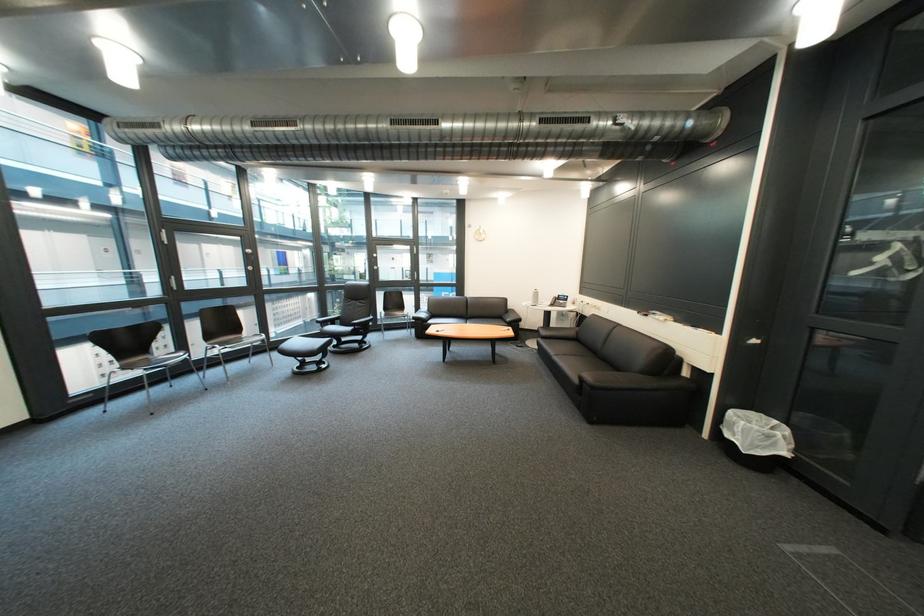
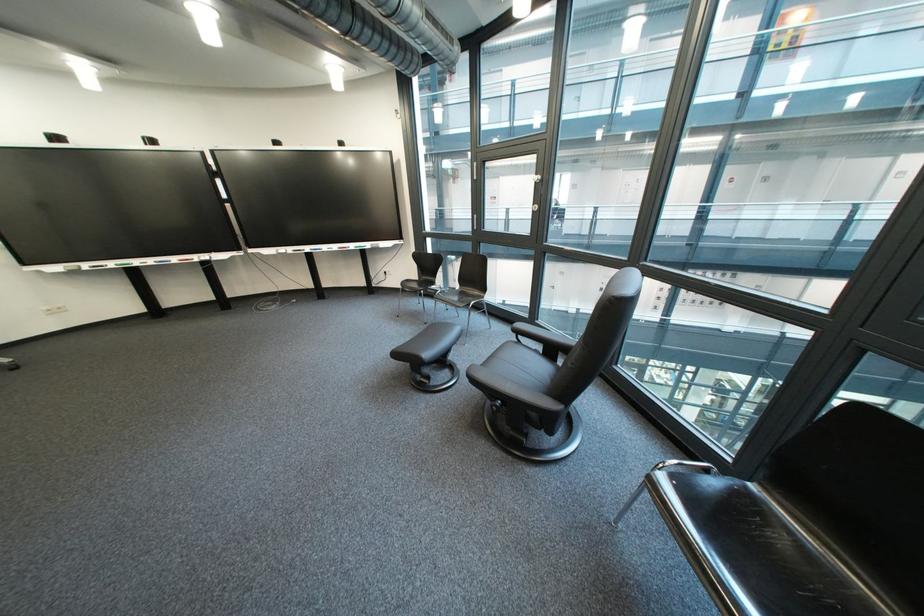
In the second image, find the point that corresponds to [220,391] in the first image.

(439, 325)